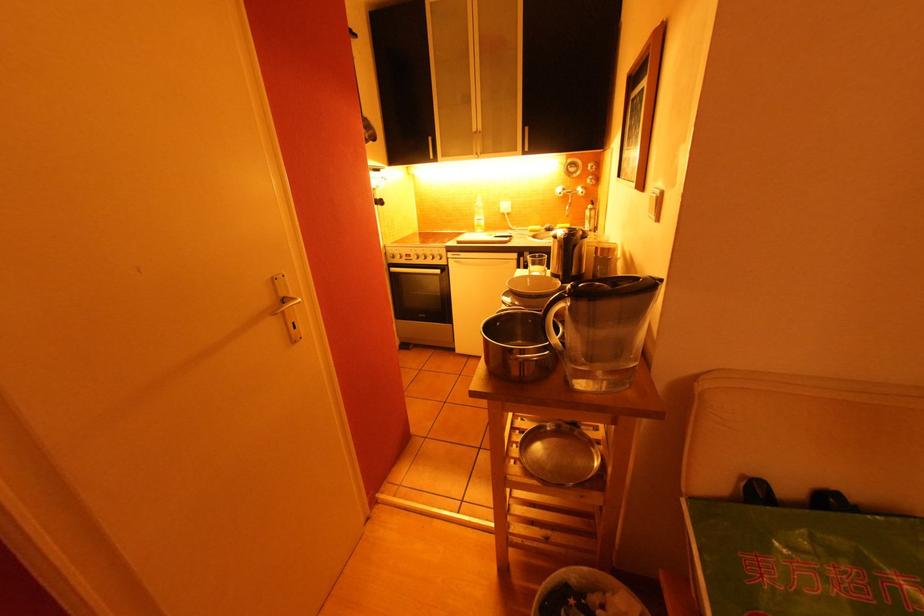
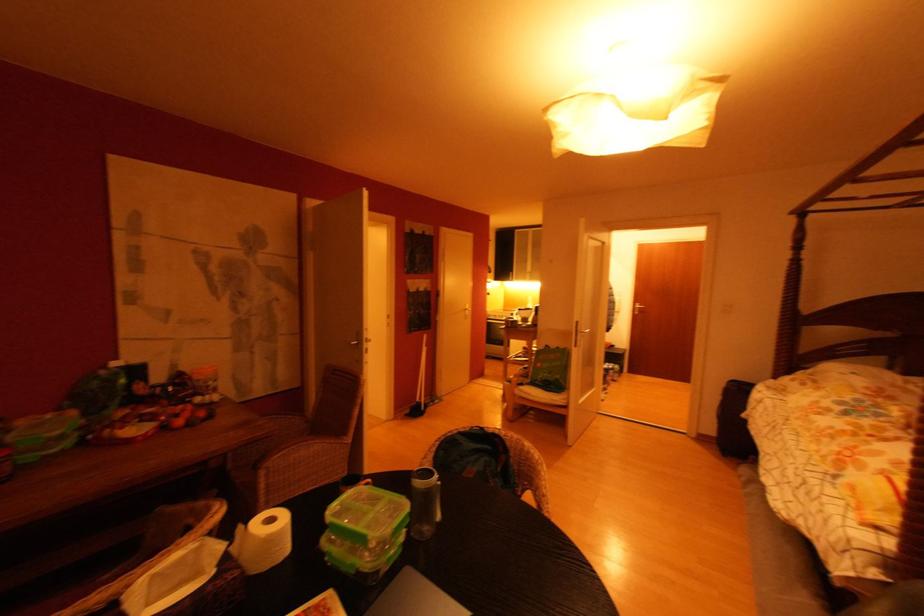
Question: The images are taken continuously from a first-person perspective. In which direction are you moving?

Choices:
 (A) Left
 (B) Right
 (C) Forward
 (D) Backward

Answer: (D)